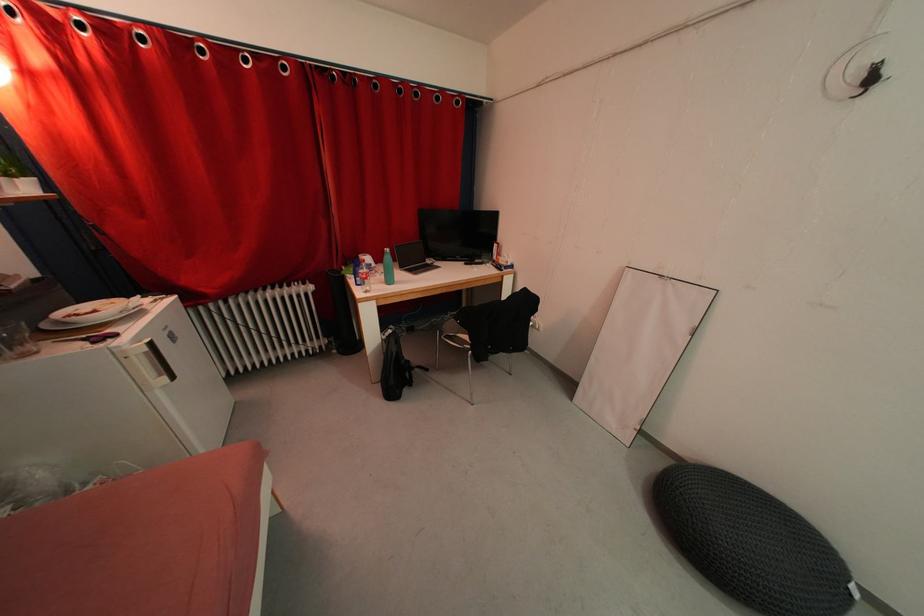
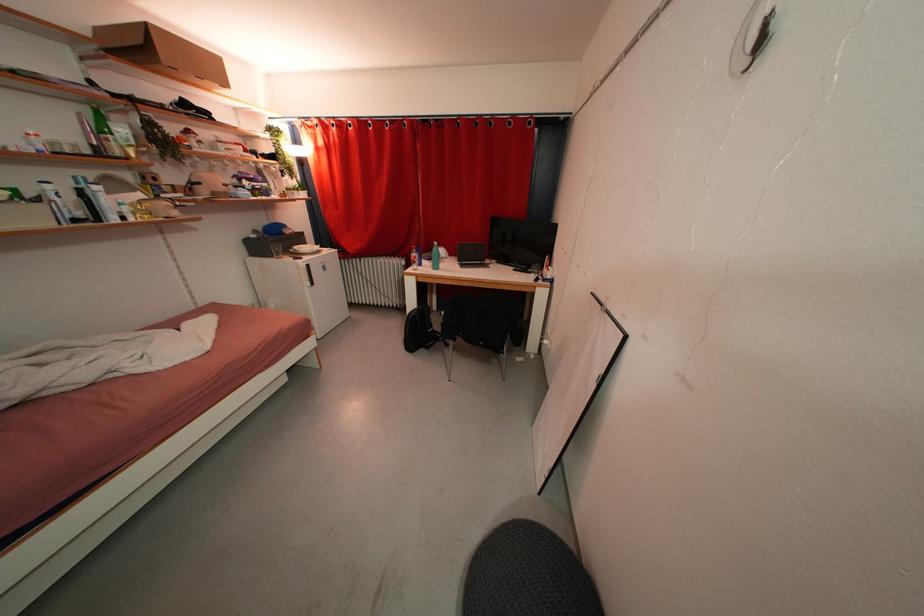
In the second image, find the point that corresponds to pixel 419 371 in the first image.

(444, 344)